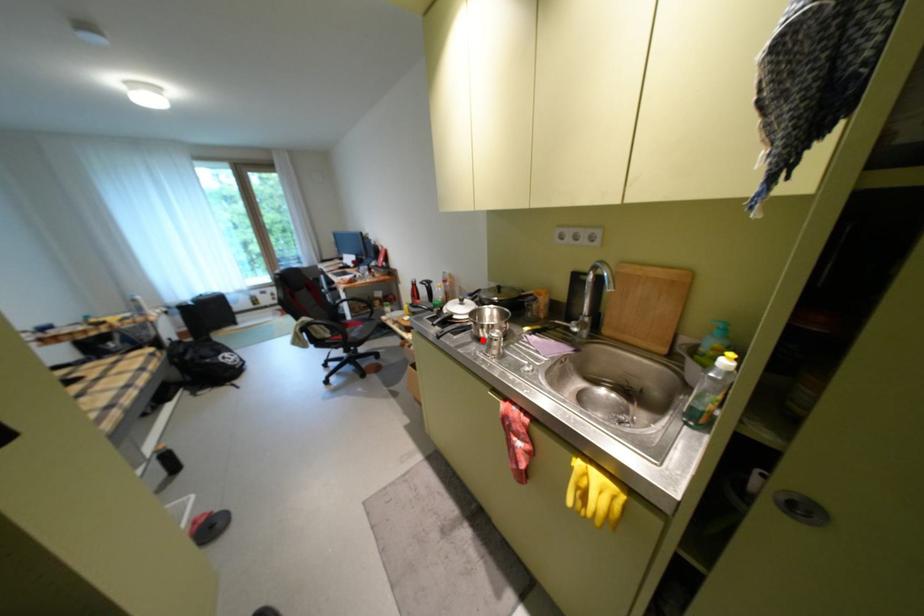
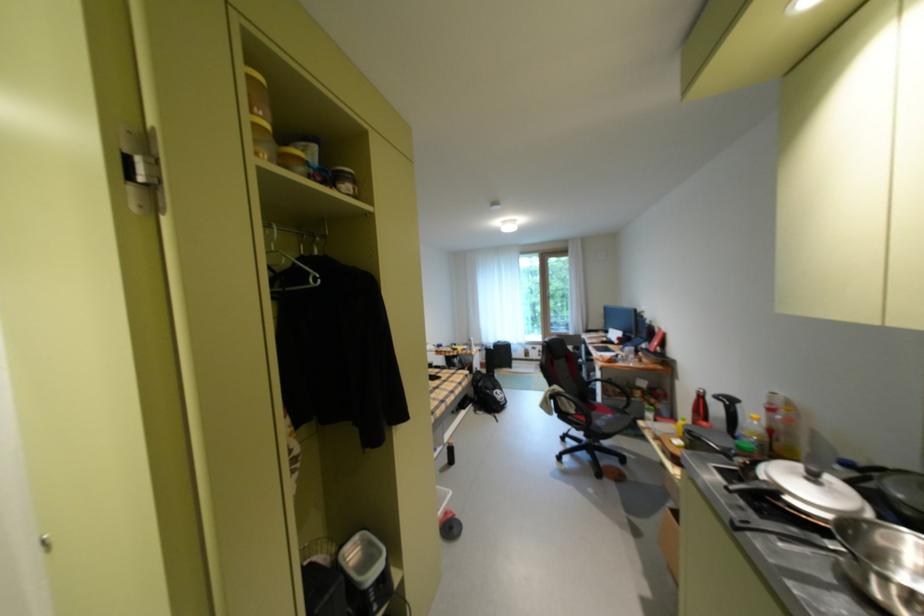
The point at the highlighted location is marked in the first image. Where is the corresponding point in the second image?

(849, 581)